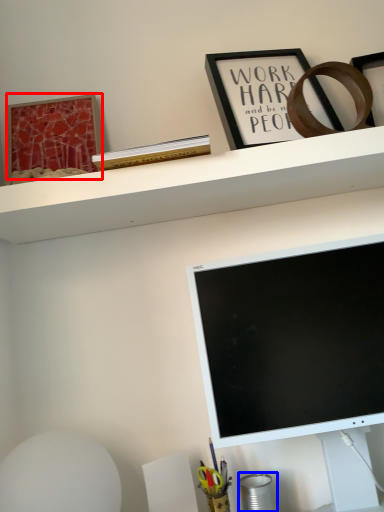
Question: Which object appears closest to the camera in this image, picture frame (highlighted by a red box) or stationery (highlighted by a blue box)?

Choices:
 (A) picture frame
 (B) stationery

Answer: (B)